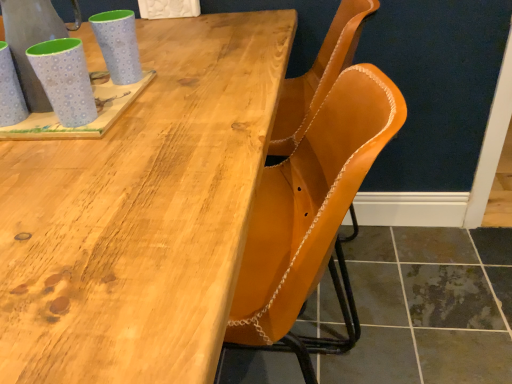
The height and width of the screenshot is (384, 512). Find the location of `unoccupied area in front of brushed metal pitcher at upper left`. unoccupied area in front of brushed metal pitcher at upper left is located at coordinates (63, 153).